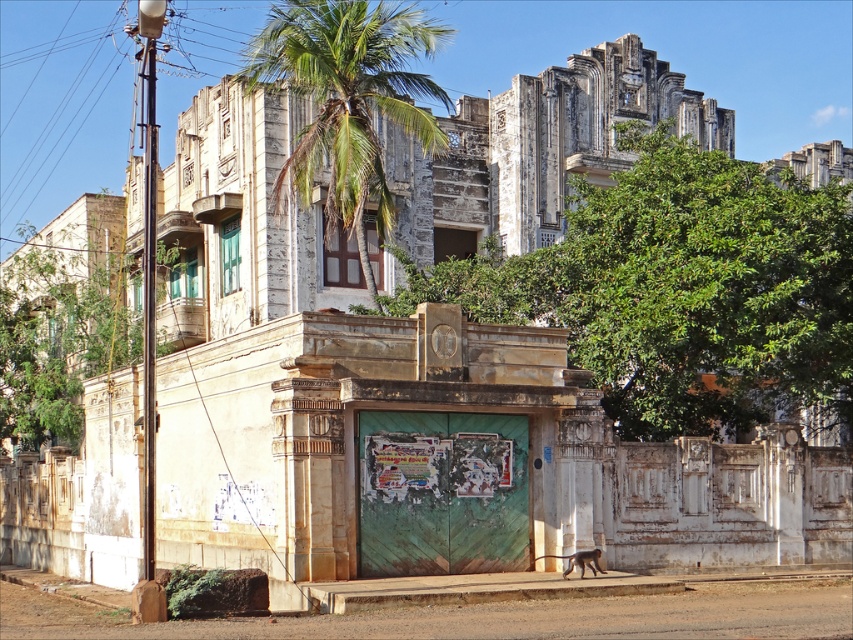
Between green leafy tree at center and green leafy tree at left, which one is positioned higher?

green leafy tree at left

The width and height of the screenshot is (853, 640). I want to click on green leafy tree at center, so click(x=682, y=291).

Can you confirm if green leafy palm tree at upper center is taller than green leafy tree at left?

Correct, green leafy palm tree at upper center is much taller as green leafy tree at left.

Is the position of green leafy palm tree at upper center less distant than that of green leafy tree at left?

Yes, it is in front of green leafy tree at left.

The image size is (853, 640). In order to click on green leafy palm tree at upper center in this screenshot , I will do `click(347, 100)`.

Looking at this image, who is positioned more to the left, green leafy tree at center or green leafy palm tree at upper center?

green leafy palm tree at upper center is more to the left.

Does point (672, 269) lie behind point (320, 12)?

No, it is not.

This screenshot has width=853, height=640. Identify the location of green leafy tree at center. (682, 291).